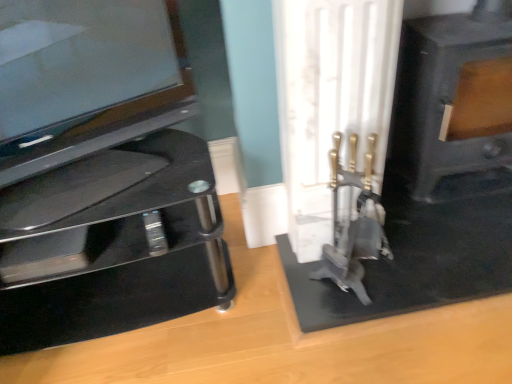
Describe the element at coordinates (87, 77) in the screenshot. I see `glossy black tv at left` at that location.

Describe the element at coordinates (120, 256) in the screenshot. I see `black glass tv stand at left` at that location.

Locate an element on the screen. black matte fireplace at right is located at coordinates (455, 104).

At what (x,y) coordinates should I click in order to perform the action: click on glossy black tv at left. Please return your answer as a coordinate pair (x, y). Looking at the image, I should click on (87, 77).

Does glossy black tv at left turn towards black matte fireplace at right?

No, glossy black tv at left is not facing towards black matte fireplace at right.

From a real-world perspective, which object stands above the other?

glossy black tv at left, from a real-world perspective.

Measure the distance from glossy black tv at left to black matte fireplace at right.

glossy black tv at left and black matte fireplace at right are 1.04 meters apart from each other.

Is glossy black tv at left inside or outside of black matte fireplace at right?

The correct answer is: outside.

Is black matte fireplace at right beside glossy black tv at left?

No, black matte fireplace at right is not next to glossy black tv at left.

Considering the sizes of objects black matte fireplace at right and glossy black tv at left in the image provided, who is shorter, black matte fireplace at right or glossy black tv at left?

With less height is glossy black tv at left.

Is the position of black matte fireplace at right more distant than that of glossy black tv at left?

Yes, black matte fireplace at right is behind glossy black tv at left.

Would you say black matte fireplace at right contains glossy black tv at left?

Actually, glossy black tv at left is outside black matte fireplace at right.

Find the location of a particular element. This screenshot has width=512, height=384. furniture below the black matte fireplace at right (from a real-world perspective) is located at coordinates (120, 256).

Considering the relative sizes of black matte fireplace at right and black glass tv stand at left in the image provided, is black matte fireplace at right thinner than black glass tv stand at left?

Yes, black matte fireplace at right is thinner than black glass tv stand at left.

Consider the image. From a real-world perspective, does black matte fireplace at right stand above black glass tv stand at left?

Indeed, from a real-world perspective, black matte fireplace at right stands above black glass tv stand at left.

Is point (209, 306) closer or farther from the camera than point (61, 99)?

Point (209, 306).

From a real-world perspective, which object stands above the other?

glossy black tv at left.

Is black glass tv stand at left in contact with glossy black tv at left?

No, black glass tv stand at left is not making contact with glossy black tv at left.

Which is in front, black glass tv stand at left or glossy black tv at left?

glossy black tv at left is more forward.

Looking at this image, from the image's perspective, is black glass tv stand at left on top of black matte fireplace at right?

No.

Considering the sizes of black glass tv stand at left and black matte fireplace at right in the image, is black glass tv stand at left taller or shorter than black matte fireplace at right?

Clearly, black glass tv stand at left is shorter compared to black matte fireplace at right.

Is black glass tv stand at left bigger or smaller than black matte fireplace at right?

black glass tv stand at left is bigger than black matte fireplace at right.

Can black glass tv stand at left be found inside glossy black tv at left?

That's incorrect, black glass tv stand at left is not inside glossy black tv at left.

Based on the photo, who is taller, glossy black tv at left or black glass tv stand at left?

Standing taller between the two is black glass tv stand at left.

Is glossy black tv at left positioned far away from black glass tv stand at left?

No.

How far apart are glossy black tv at left and black glass tv stand at left?

The distance of glossy black tv at left from black glass tv stand at left is 29.90 centimeters.

Locate an element on the screen. The height and width of the screenshot is (384, 512). fireplace below the glossy black tv at left (from a real-world perspective) is located at coordinates (455, 104).

Where is `fireplace that is above the glossy black tv at left (from the image's perspective)`? The height and width of the screenshot is (384, 512). fireplace that is above the glossy black tv at left (from the image's perspective) is located at coordinates (455, 104).

Which object lies nearer to the anchor point black matte fireplace at right, glossy black tv at left or black glass tv stand at left?

Among the two, black glass tv stand at left is located nearer to black matte fireplace at right.

Considering their positions, is black matte fireplace at right positioned closer to black glass tv stand at left than glossy black tv at left?

glossy black tv at left is closer to black glass tv stand at left.

When comparing their distances from black glass tv stand at left, does glossy black tv at left or black matte fireplace at right seem further?

Based on the image, black matte fireplace at right appears to be further to black glass tv stand at left.

From the image, which object appears to be nearer to black matte fireplace at right, black glass tv stand at left or glossy black tv at left?

Based on the image, black glass tv stand at left appears to be nearer to black matte fireplace at right.

From the image, which object appears to be farther from glossy black tv at left, black matte fireplace at right or black glass tv stand at left?

black matte fireplace at right.

Which object lies further to the anchor point glossy black tv at left, black glass tv stand at left or black matte fireplace at right?

Based on the image, black matte fireplace at right appears to be further to glossy black tv at left.

Where is `television between black glass tv stand at left and black matte fireplace at right in the horizontal direction`? Image resolution: width=512 pixels, height=384 pixels. television between black glass tv stand at left and black matte fireplace at right in the horizontal direction is located at coordinates (87, 77).